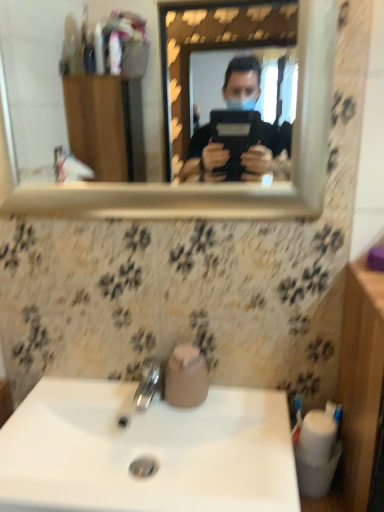
Find the location of a particular element. vacant area that lies to the right of polished chrome tap at center is located at coordinates (248, 414).